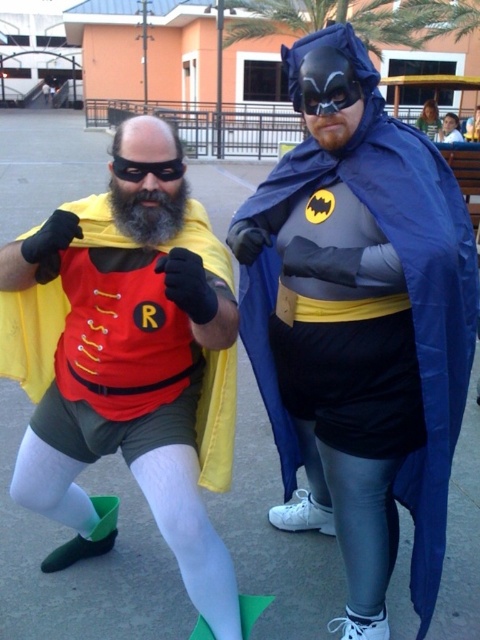
Question: Which object appears farthest from the camera in this image?

Choices:
 (A) matte red vest at center
 (B) smooth plastic cup at upper right
 (C) matte black cape at center

Answer: (B)

Question: Is matte black cape at center in front of smooth plastic cup at upper right?

Choices:
 (A) yes
 (B) no

Answer: (A)

Question: Is matte black cape at center below matte red vest at center?

Choices:
 (A) yes
 (B) no

Answer: (B)

Question: Among these points, which one is nearest to the camera?

Choices:
 (A) (469, 138)
 (B) (312, 90)

Answer: (B)

Question: Can you confirm if matte black cape at center is thinner than smooth plastic cup at upper right?

Choices:
 (A) yes
 (B) no

Answer: (B)

Question: Which of these objects is positioned farthest from the matte black cape at center?

Choices:
 (A) smooth plastic cup at upper right
 (B) matte red vest at center

Answer: (A)